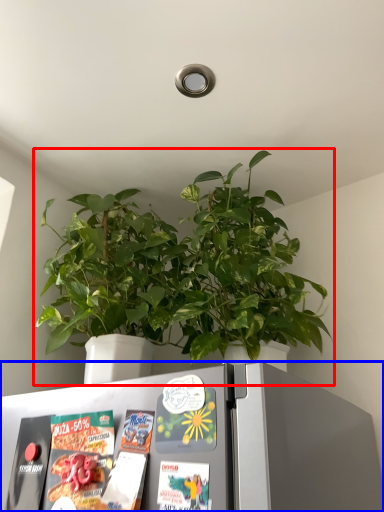
Question: Which point is closer to the camera, houseplant (highlighted by a red box) or refrigerator (highlighted by a blue box)?

Choices:
 (A) houseplant
 (B) refrigerator

Answer: (B)